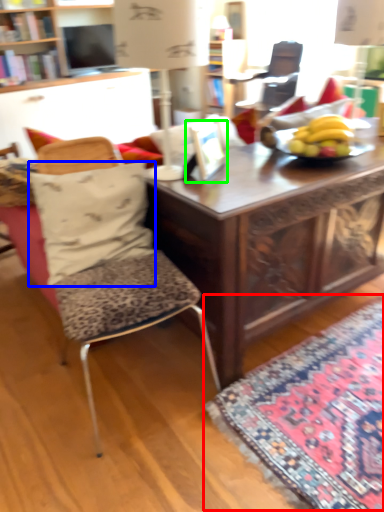
Question: Based on their relative distances, which object is nearer to mat (highlighted by a red box)? Choose from pillow (highlighted by a blue box) and picture frame (highlighted by a green box).

Choices:
 (A) pillow
 (B) picture frame

Answer: (A)